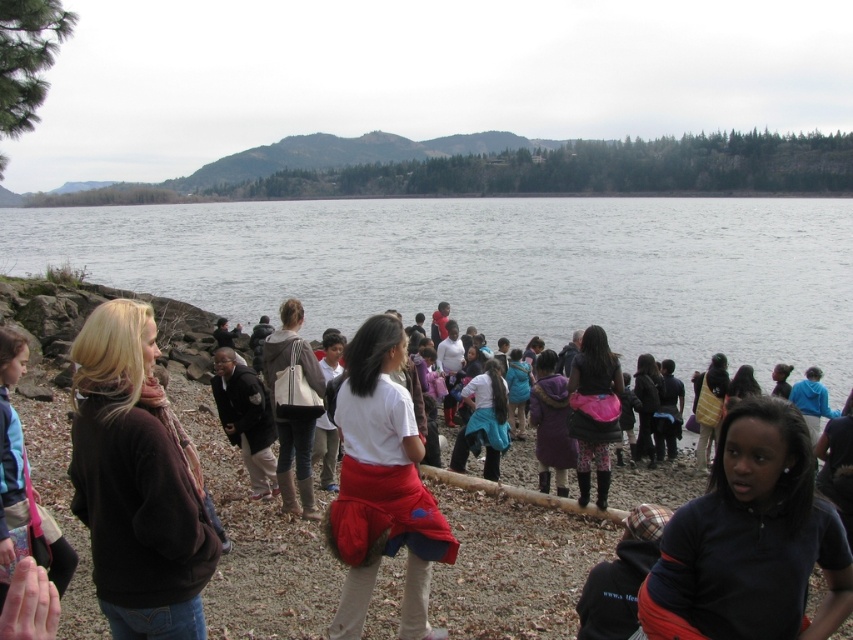
Does gray water at center come in front of black matte shirt at lower right?

That is False.

Does point (790, 243) lie in front of point (846, 576)?

No, it is behind (846, 576).

This screenshot has width=853, height=640. Find the location of `gray water at center`. gray water at center is located at coordinates (492, 268).

Between gray water at center and dark purple fabric skirt at center, which one appears on the right side from the viewer's perspective?

From the viewer's perspective, dark purple fabric skirt at center appears more on the right side.

Which is in front, point (762, 387) or point (606, 384)?

Point (606, 384)

Is point (495, 321) positioned in front of point (596, 413)?

No.

Find the location of a particular element. This screenshot has width=853, height=640. gray water at center is located at coordinates 492,268.

Does black matte shirt at lower right lie in front of matte beige handbag at center?

Yes, it is.

Is point (788, 548) closer to viewer compared to point (287, 484)?

That is True.

Is point (808, 538) positioned behind point (300, 307)?

No.

The height and width of the screenshot is (640, 853). I want to click on black matte shirt at lower right, so click(750, 540).